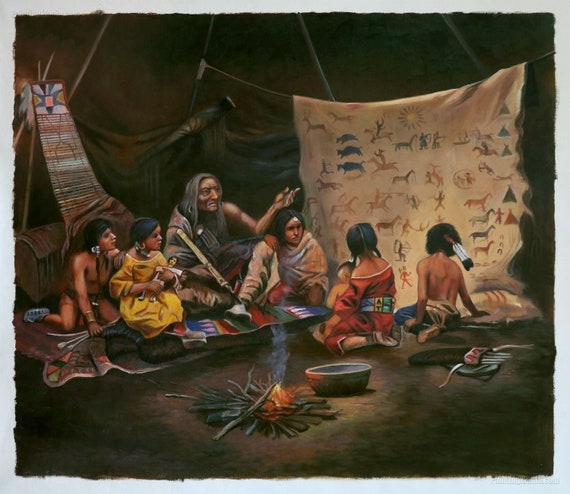
Locate an element on the screen. blanket is located at coordinates click(x=382, y=177), click(x=284, y=311).